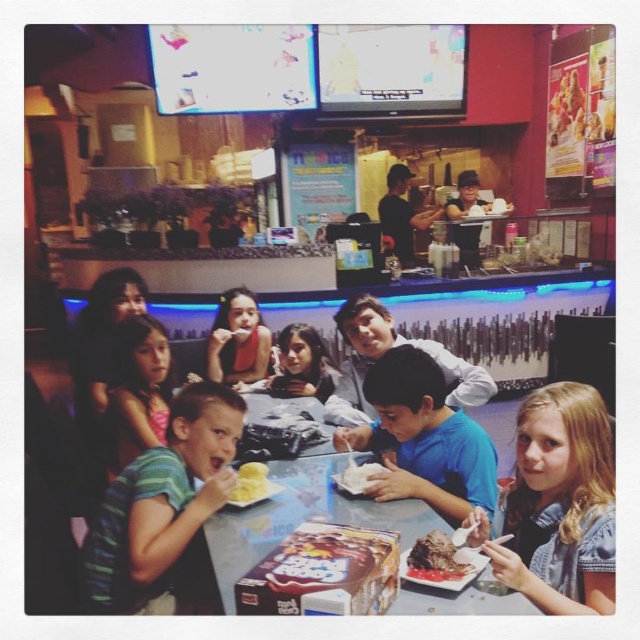
Question: Can you confirm if white paper plate at center is positioned above white fluffy cake at lower center?

Choices:
 (A) no
 (B) yes

Answer: (A)

Question: Which is farther from the matte black shirt at upper center?

Choices:
 (A) blue cotton shirt at center
 (B) striped cotton shirt at lower left

Answer: (B)

Question: Which point is closer to the camera?

Choices:
 (A) white fluffy cake at lower center
 (B) golden brown meat at center
 (C) light brown hair at lower right

Answer: (C)

Question: Does blue cotton shirt at center have a smaller size compared to matte black shirt at upper center?

Choices:
 (A) yes
 (B) no

Answer: (A)

Question: Estimate the real-world distances between objects in this image. Which object is farther from the white paper plate at center?

Choices:
 (A) yellow creamy ice cream at center
 (B) white fluffy cake at lower center

Answer: (A)

Question: Is light brown hair at lower right above white shirt at center?

Choices:
 (A) yes
 (B) no

Answer: (B)